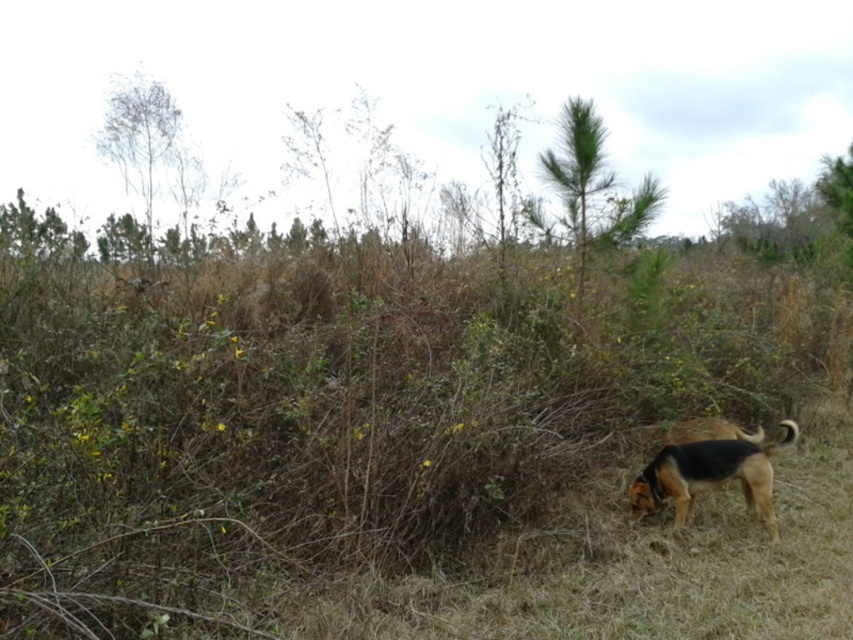
Which of these two, bare branches at upper left or brown fur dog at lower right, stands shorter?

With less height is brown fur dog at lower right.

Can you confirm if bare branches at upper left is positioned above brown fur dog at lower right?

Correct, bare branches at upper left is located above brown fur dog at lower right.

Is point (103, 120) positioned after point (656, 477)?

Yes.

Locate an element on the screen. Image resolution: width=853 pixels, height=640 pixels. bare branches at upper left is located at coordinates (144, 144).